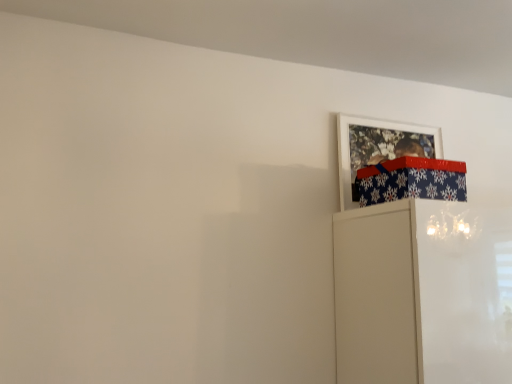
Question: Considering their positions, is blue snowflake-patterned wrapping paper at upper right located in front of or behind white matte picture frame at upper right?

Choices:
 (A) front
 (B) behind

Answer: (A)

Question: In terms of height, does blue snowflake-patterned wrapping paper at upper right look taller or shorter compared to white matte picture frame at upper right?

Choices:
 (A) tall
 (B) short

Answer: (B)

Question: Is blue snowflake-patterned wrapping paper at upper right to the left or to the right of white matte picture frame at upper right in the image?

Choices:
 (A) left
 (B) right

Answer: (A)

Question: Relative to blue snowflake-patterned wrapping paper at upper right, is white matte picture frame at upper right in front or behind?

Choices:
 (A) front
 (B) behind

Answer: (B)

Question: In terms of width, does white matte picture frame at upper right look wider or thinner when compared to blue snowflake-patterned wrapping paper at upper right?

Choices:
 (A) thin
 (B) wide

Answer: (A)

Question: Would you say white matte picture frame at upper right is inside or outside blue snowflake-patterned wrapping paper at upper right?

Choices:
 (A) outside
 (B) inside

Answer: (A)

Question: In the image, is white matte picture frame at upper right on the left side or the right side of blue snowflake-patterned wrapping paper at upper right?

Choices:
 (A) left
 (B) right

Answer: (B)